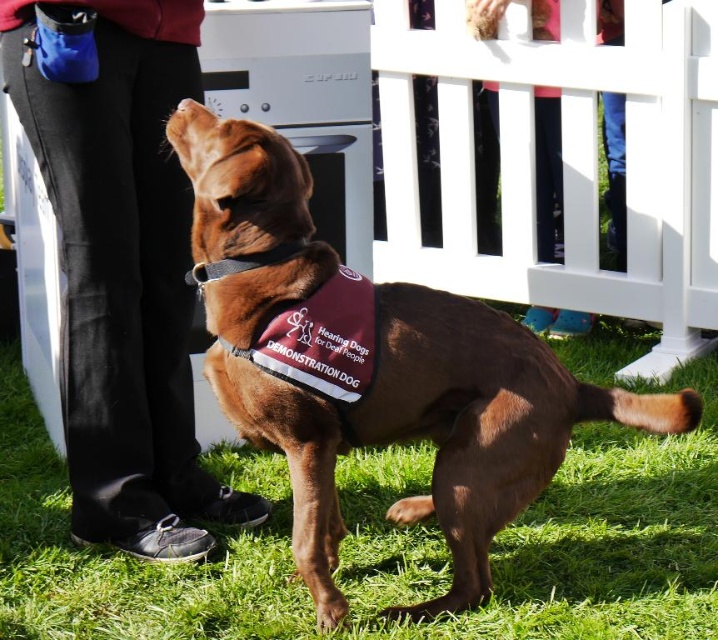
You are a photographer standing in front of the black leather pants at left. You want to take a photo of the chocolate Labrador Retriever wearing a maroon vest labeled

The black leather pants at left are 9.82 feet away from the viewer, so you can position yourself close enough to capture the chocolate Labrador Retriever in focus while keeping the black leather pants at left in the foreground for context.

You are a photographer setting up for an outdoor event. You have a camera with a limited focus area. You need to decide whether to focus on the green grass at lower center or the brown fabric vest at center first. Based on their sizes, which object should you prioritize focusing on to ensure it fills more of your frame?

The green grass at lower center has a larger size compared to the brown fabric vest at center, so you should prioritize focusing on the green grass at lower center to ensure it fills more of your frame.